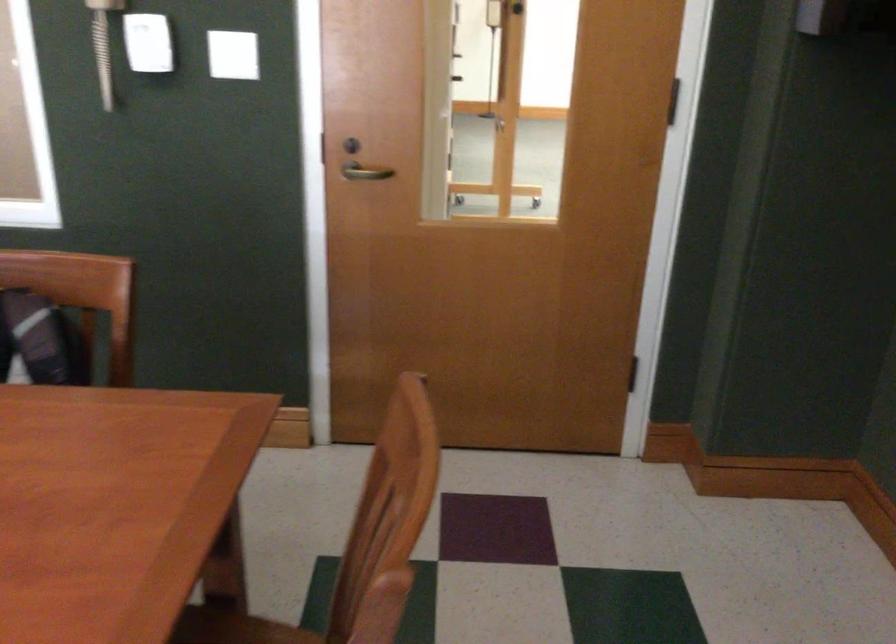
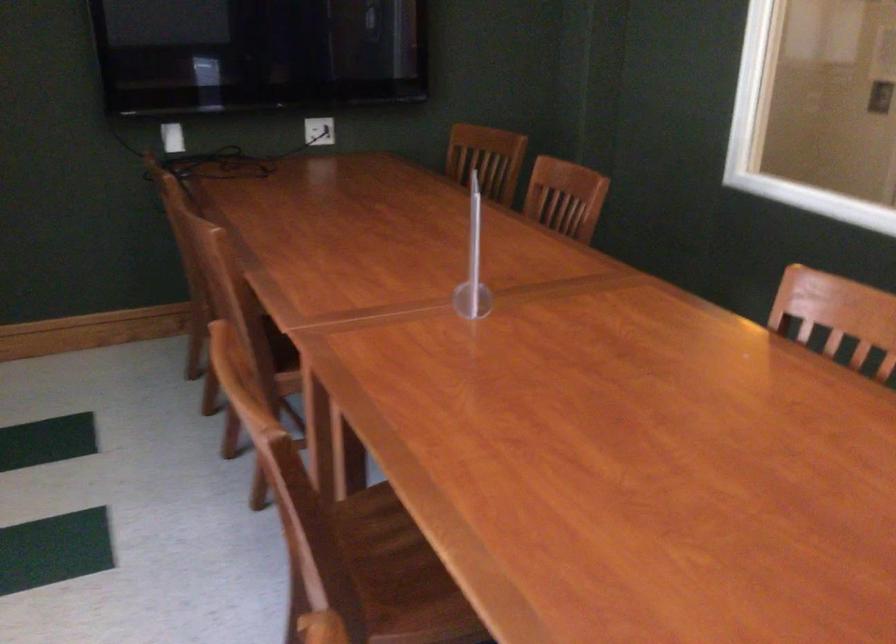
Question: The images are taken continuously from a first-person perspective. In which direction is your viewpoint rotating?

Choices:
 (A) Left
 (B) Right
 (C) Up
 (D) Down

Answer: (A)